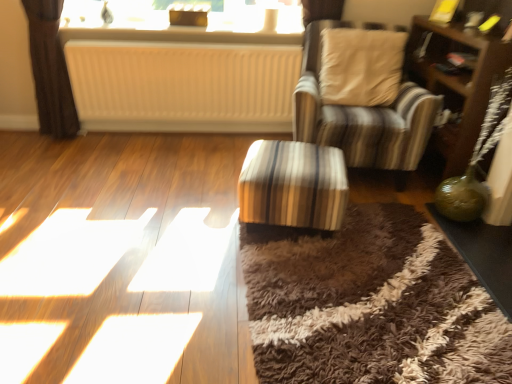
Question: Considering the positions of white ribbed radiator at center and striped fabric ottoman at center, positioned as the 2th table in right-to-left order, in the image, is white ribbed radiator at center bigger or smaller than striped fabric ottoman at center, positioned as the 2th table in right-to-left order,?

Choices:
 (A) big
 (B) small

Answer: (A)

Question: From a real-world perspective, is white ribbed radiator at center positioned above or below striped fabric ottoman at center, positioned as the 2th table in right-to-left order?

Choices:
 (A) above
 (B) below

Answer: (A)

Question: Which is farther from the green glass table at lower right, arranged as the first table when viewed from the right?

Choices:
 (A) white ribbed radiator at center
 (B) striped fabric ottoman at center, which ranks as the first table in left-to-right order
 (C) striped fabric chair at center
 (D) brown wooden dresser at right
 (E) white textured radiator at upper center

Answer: (E)

Question: Which object is positioned closest to the green glass table at lower right, the second table when ordered from left to right?

Choices:
 (A) white textured radiator at upper center
 (B) striped fabric chair at center
 (C) striped fabric ottoman at center, which ranks as the first table in left-to-right order
 (D) brown wooden dresser at right
 (E) white ribbed radiator at center

Answer: (B)